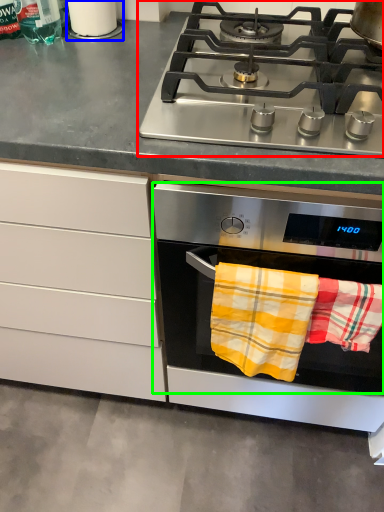
Question: Considering the real-world distances, which object is closest to gas stove (highlighted by a red box)? appliance (highlighted by a blue box) or oven (highlighted by a green box).

Choices:
 (A) appliance
 (B) oven

Answer: (B)